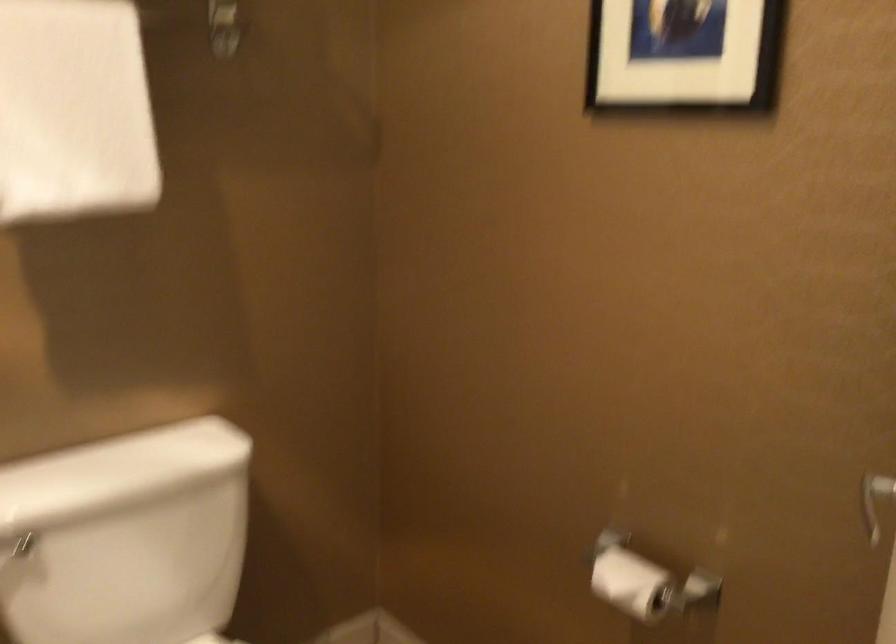
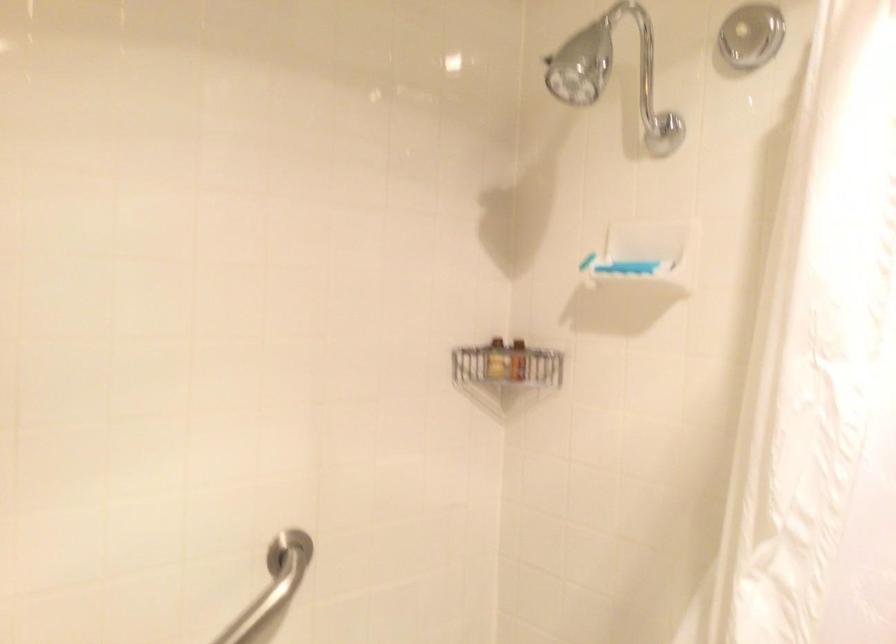
Question: The camera is either moving clockwise (left) or counter-clockwise (right) around the object. The first image is from the beginning of the video and the second image is from the end. Is the camera moving left or right when shooting the video?

Choices:
 (A) Left
 (B) Right

Answer: (B)